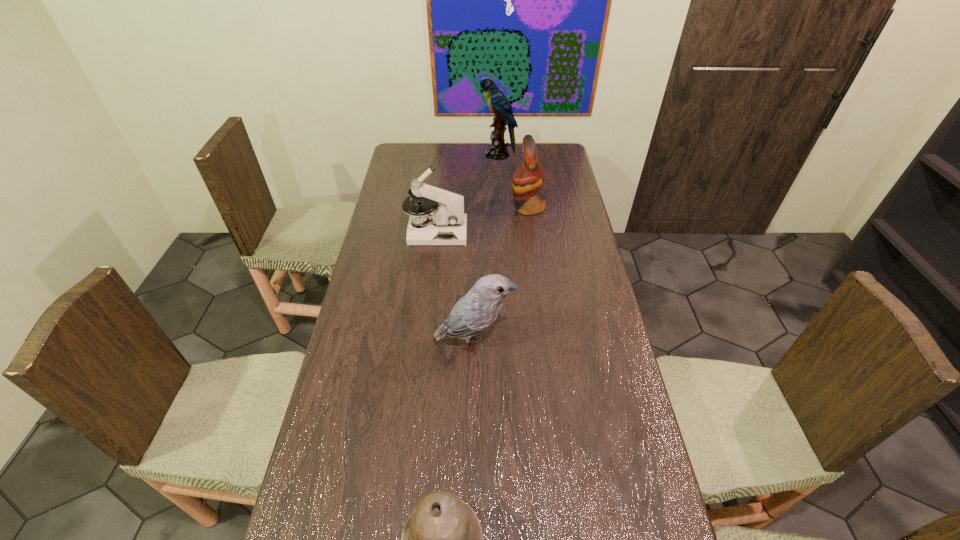
Identify the location of empty space that is in between the third farthest object and the nearest parrot. This screenshot has width=960, height=540. (455, 287).

Locate an element on the screen. free area in between the microscope and the farthest object is located at coordinates (467, 193).

The image size is (960, 540). In order to click on vacant region between the third farthest object and the farthest parrot in this screenshot , I will do `click(467, 193)`.

The width and height of the screenshot is (960, 540). Identify the location of vacant space that is in between the second nearest object and the microscope. (455, 287).

Select which object is the second closest to the microscope. Please provide its 2D coordinates. Your answer should be formatted as a tuple, i.e. [(x, y)], where the tuple contains the x and y coordinates of a point satisfying the conditions above.

[(477, 310)]

Choose which object is the second nearest neighbor to the microscope. Please provide its 2D coordinates. Your answer should be formatted as a tuple, i.e. [(x, y)], where the tuple contains the x and y coordinates of a point satisfying the conditions above.

[(477, 310)]

You are a GUI agent. You are given a task and a screenshot of the screen. Output one action in this format:
    pyautogui.click(x=<x>, y=<y>)
    Task: Click on the parrot that is the closest to the shortest object
    
    Given the screenshot: What is the action you would take?
    pyautogui.click(x=477, y=310)

Locate which parrot is the third closest to the bell. Please provide its 2D coordinates. Your answer should be formatted as a tuple, i.e. [(x, y)], where the tuple contains the x and y coordinates of a point satisfying the conditions above.

[(498, 103)]